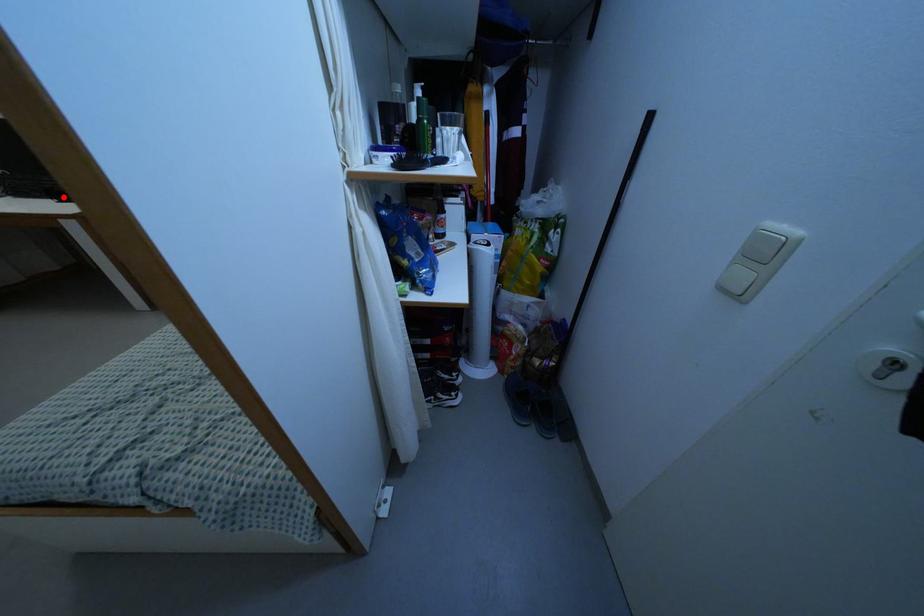
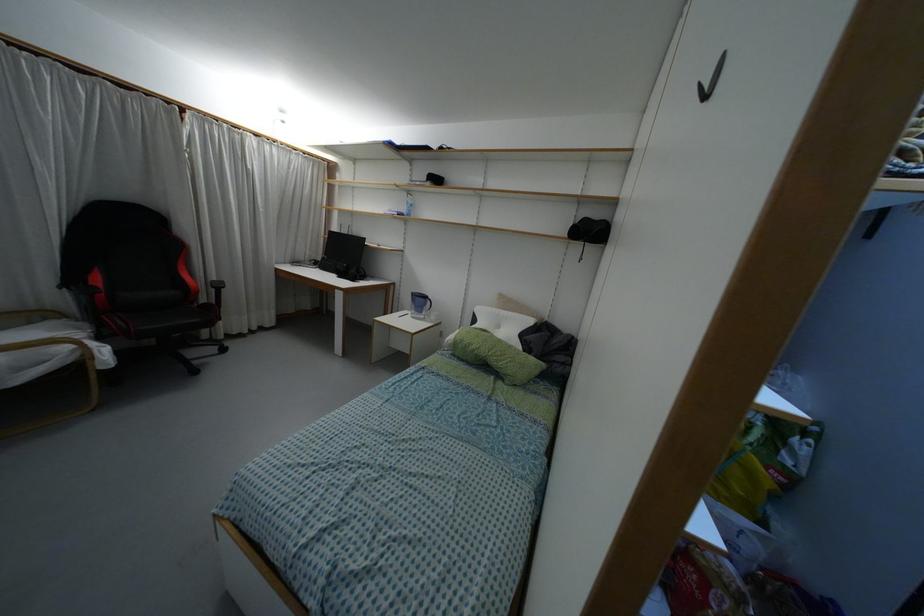
Question: I am providing you with two images of the same scene from different viewpoints. A red point is shown in image1. For the corresponding object point in image2, is it positioned nearer or farther from the camera?

Choices:
 (A) Nearer
 (B) Farther

Answer: (A)